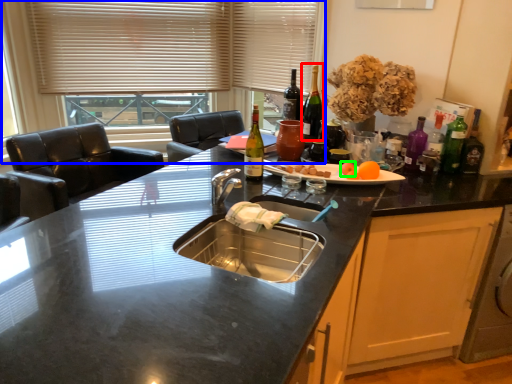
Question: Which object is positioned closest to wine bottle (highlighted by a red box)? Select from window (highlighted by a blue box) and food (highlighted by a green box).

Choices:
 (A) window
 (B) food

Answer: (B)